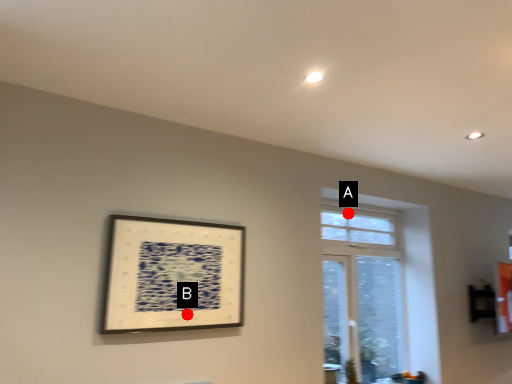
Question: Two points are circled on the image, labeled by A and B beside each circle. Which point is closer to the camera taking this photo?

Choices:
 (A) A is closer
 (B) B is closer

Answer: (B)